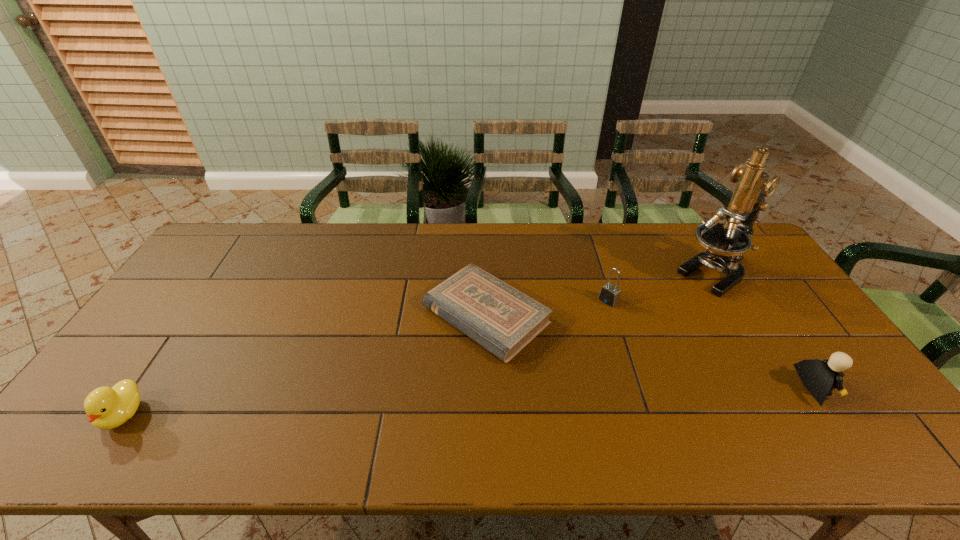
This screenshot has width=960, height=540. I want to click on vacant space located 0.210m on the shackle of the third object from left to right, so click(558, 341).

Identify the location of vacant space located 0.320m on the shackle of the third object from left to right. (531, 363).

Locate an element on the screen. vacant space located 0.160m on the shackle of the third object from left to right is located at coordinates (569, 332).

The image size is (960, 540). I want to click on free space located on the spine side of the Bible, so click(396, 386).

Identify the location of free region located 0.100m on the spine side of the Bible. The width and height of the screenshot is (960, 540). (412, 374).

I want to click on free space located 0.140m on the spine side of the Bible, so click(399, 383).

I want to click on object that is positioned at the far edge, so click(x=725, y=243).

The image size is (960, 540). I want to click on duckling that is positioned at the near edge, so click(106, 408).

Where is `Lego that is at the near edge`? Lego that is at the near edge is located at coordinates (819, 377).

Where is `object situated at the left edge`? The height and width of the screenshot is (540, 960). object situated at the left edge is located at coordinates click(x=106, y=408).